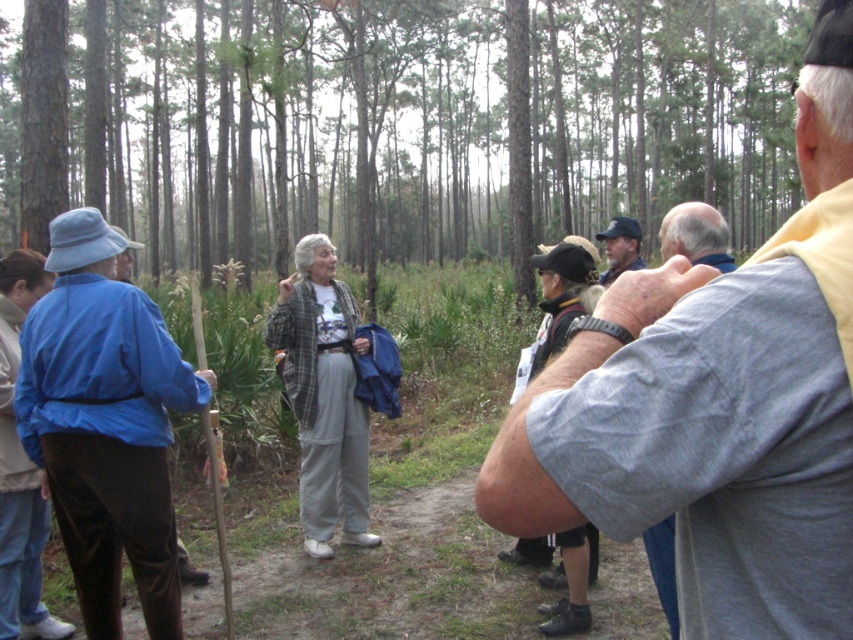
Does blue fabric jacket at left appear on the left side of matte blue cap at center?

Indeed, blue fabric jacket at left is positioned on the left side of matte blue cap at center.

Who is higher up, blue fabric jacket at left or matte blue cap at center?

matte blue cap at center

Does point (146, 364) come closer to viewer compared to point (606, 230)?

Yes, it is.

The width and height of the screenshot is (853, 640). What are the coordinates of `blue fabric jacket at left` in the screenshot? It's located at (105, 422).

Does plaid fabric jacket at center have a lesser height compared to matte blue cap at center?

Incorrect, plaid fabric jacket at center's height does not fall short of matte blue cap at center's.

What do you see at coordinates (323, 396) in the screenshot?
I see `plaid fabric jacket at center` at bounding box center [323, 396].

The image size is (853, 640). Identify the location of plaid fabric jacket at center. (323, 396).

Who is positioned more to the left, gray fabric shirt at upper right or plaid fabric jacket at center?

Positioned to the left is plaid fabric jacket at center.

Does gray fabric shirt at upper right have a greater height compared to plaid fabric jacket at center?

In fact, gray fabric shirt at upper right may be shorter than plaid fabric jacket at center.

Is point (843, 529) farther from camera compared to point (345, 524)?

No, it is not.

Where is `gray fabric shirt at upper right`? The image size is (853, 640). gray fabric shirt at upper right is located at coordinates (717, 404).